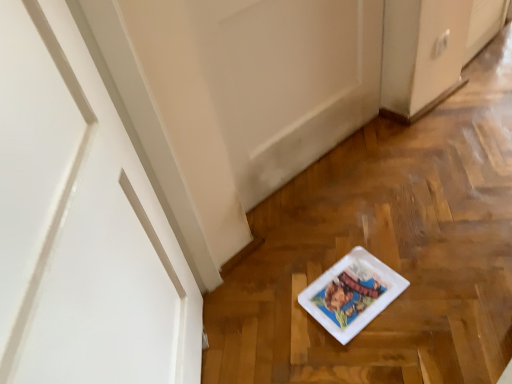
This screenshot has height=384, width=512. What are the coordinates of `vacant space behind white glossy platter at center` in the screenshot? It's located at pos(328,232).